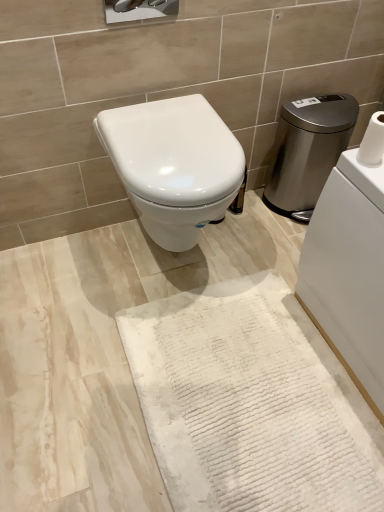
Question: From a real-world perspective, is white textured toilet paper at upper right under stainless steel water heater at right?

Choices:
 (A) no
 (B) yes

Answer: (A)

Question: Does white textured toilet paper at upper right have a greater width compared to stainless steel water heater at right?

Choices:
 (A) no
 (B) yes

Answer: (A)

Question: Does white textured toilet paper at upper right lie in front of stainless steel water heater at right?

Choices:
 (A) no
 (B) yes

Answer: (B)

Question: Can you confirm if white textured toilet paper at upper right is bigger than stainless steel water heater at right?

Choices:
 (A) no
 (B) yes

Answer: (A)

Question: Are white textured toilet paper at upper right and stainless steel water heater at right located far from each other?

Choices:
 (A) yes
 (B) no

Answer: (B)

Question: Relative to white textured toilet paper at upper right, is white glossy toilet at center in front or behind?

Choices:
 (A) behind
 (B) front

Answer: (A)

Question: Considering the relative positions of white glossy toilet at center and white textured toilet paper at upper right in the image provided, is white glossy toilet at center to the left or to the right of white textured toilet paper at upper right?

Choices:
 (A) right
 (B) left

Answer: (B)

Question: From the image's perspective, is white glossy toilet at center located above or below white textured toilet paper at upper right?

Choices:
 (A) above
 (B) below

Answer: (B)

Question: From a real-world perspective, relative to white textured toilet paper at upper right, is white glossy toilet at center vertically above or below?

Choices:
 (A) above
 (B) below

Answer: (B)

Question: From the image's perspective, relative to white textured bath mat at center, is white textured toilet paper at upper right above or below?

Choices:
 (A) below
 (B) above

Answer: (B)

Question: Is white textured toilet paper at upper right to the left or to the right of white textured bath mat at center in the image?

Choices:
 (A) left
 (B) right

Answer: (B)

Question: Looking at their shapes, would you say white textured toilet paper at upper right is wider or thinner than white textured bath mat at center?

Choices:
 (A) thin
 (B) wide

Answer: (A)

Question: Considering the positions of white textured toilet paper at upper right and white textured bath mat at center in the image, is white textured toilet paper at upper right taller or shorter than white textured bath mat at center?

Choices:
 (A) tall
 (B) short

Answer: (A)

Question: Is stainless steel water heater at right in front of or behind white glossy toilet at center in the image?

Choices:
 (A) behind
 (B) front

Answer: (A)

Question: From the image's perspective, is stainless steel water heater at right above or below white glossy toilet at center?

Choices:
 (A) above
 (B) below

Answer: (A)